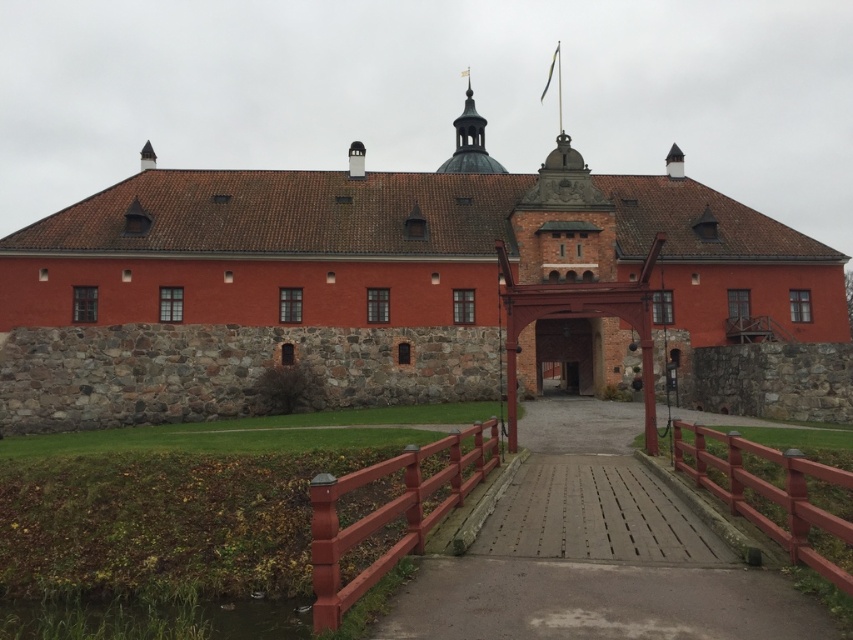
Question: Considering the relative positions of red brick castle at center and brown wooden gate at center in the image provided, where is red brick castle at center located with respect to brown wooden gate at center?

Choices:
 (A) below
 (B) above

Answer: (B)

Question: Can you confirm if red brick castle at center is thinner than brown wooden gate at center?

Choices:
 (A) yes
 (B) no

Answer: (B)

Question: Which of the following is the farthest from the observer?

Choices:
 (A) (300, 276)
 (B) (566, 364)

Answer: (B)

Question: Does red brick castle at center have a greater width compared to brown wooden gate at center?

Choices:
 (A) yes
 (B) no

Answer: (A)